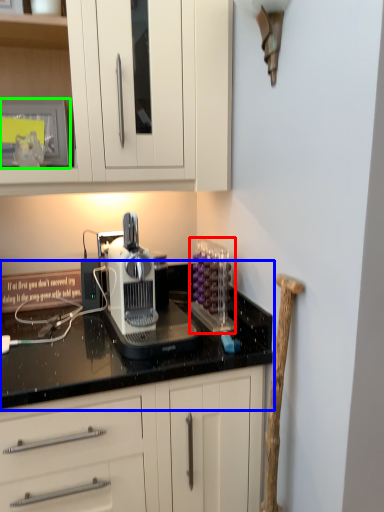
Question: Which object is positioned closest to kitchen appliance (highlighted by a red box)? Select from countertop (highlighted by a blue box) and appliance (highlighted by a green box).

Choices:
 (A) countertop
 (B) appliance

Answer: (A)